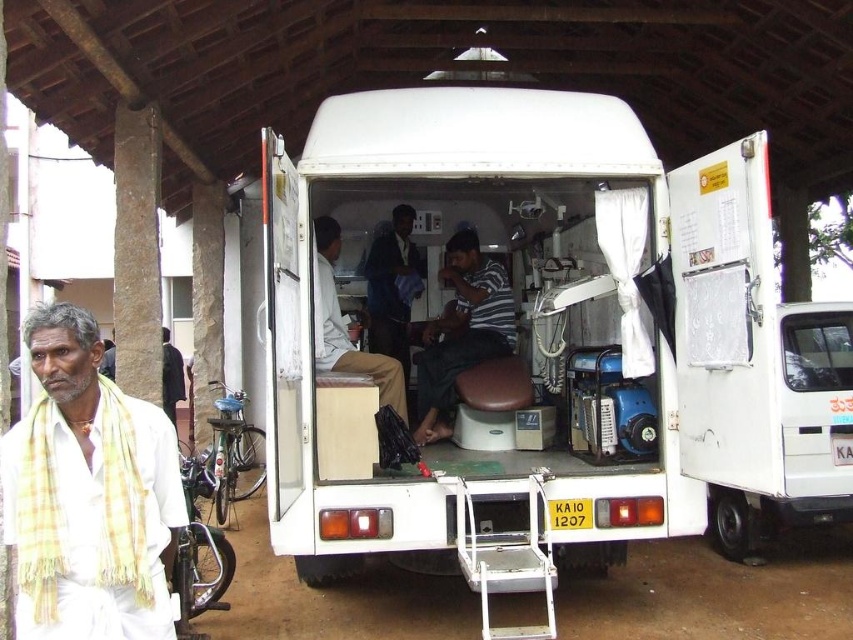
You are standing at point (x=457, y=248) and want to walk to the white van parked inside the sheltered area. Is the point (x=125, y=570) located between you and the van?

Point (x=125, y=570) is in front of point (x=457, y=248), so yes, it is between you and the van.

In the scene shown: You are a delivery person standing at the entrance of the shelter. You need to hand over a package to the person wearing the white cotton shirt at center. However, there is a dark blue shirt at center blocking your path. Is there enough space between the two shirts to walk through?

The white cotton shirt at center and dark blue shirt at center are 6.23 feet apart, so there is sufficient space between them for the delivery person to walk through and reach the person wearing the white cotton shirt at center.

You are standing at the center of the covered structure and want to locate the yellow checkered scarf at left. According to the scene, where should you look relative to your position?

The yellow checkered scarf at left is located at the lower left area of the scene since its 2D coordinates are at point (88, 493). In a standard coordinate system, this places it towards the lower left quadrant relative to your position at the center.